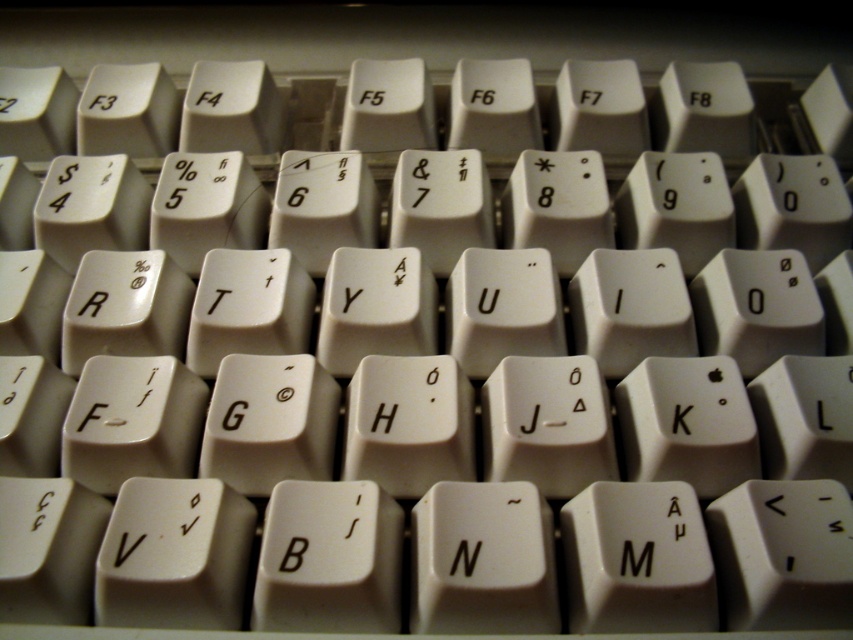
Is point (468, 563) more distant than point (376, 416)?

No, (468, 563) is in front of (376, 416).

Who is shorter, white plastic letter n at center or white plastic letter h at center?

Standing shorter between the two is white plastic letter n at center.

Is point (465, 554) positioned after point (395, 410)?

No.

Where is `white plastic letter n at center`? white plastic letter n at center is located at coordinates (465, 557).

Does white plastic letter m at center lie in front of white plastic letter n at center?

No, it is behind white plastic letter n at center.

This screenshot has width=853, height=640. In order to click on white plastic letter m at center in this screenshot , I will do `click(636, 557)`.

Does white plastic letter m at center have a lesser width compared to white plastic letter h at center?

Incorrect, white plastic letter m at center's width is not less than white plastic letter h at center's.

Can you confirm if white plastic letter m at center is bigger than white plastic letter h at center?

Yes, white plastic letter m at center is bigger than white plastic letter h at center.

Which is behind, point (627, 548) or point (384, 433)?

The point (384, 433) is behind.

This screenshot has height=640, width=853. What are the coordinates of `white plastic letter m at center` in the screenshot? It's located at (636, 557).